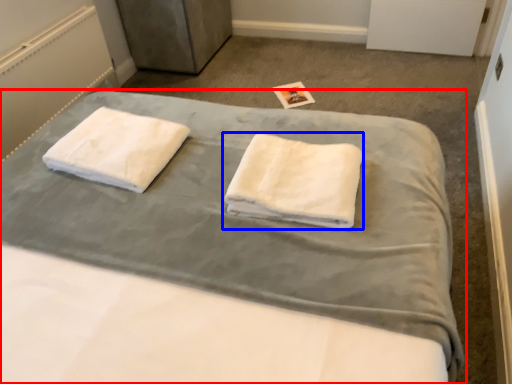
Question: Which point is closer to the camera, bed (highlighted by a red box) or towel (highlighted by a blue box)?

Choices:
 (A) bed
 (B) towel

Answer: (A)